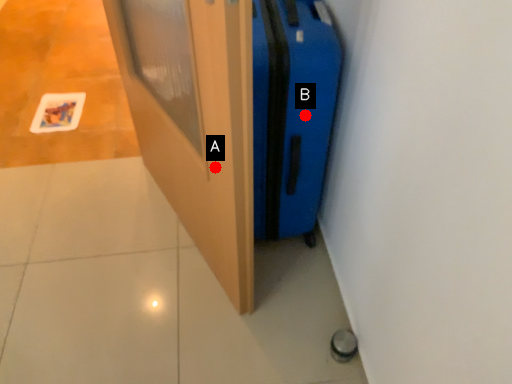
Question: Two points are circled on the image, labeled by A and B beside each circle. Which point is further to the camera?

Choices:
 (A) A is further
 (B) B is further

Answer: (B)